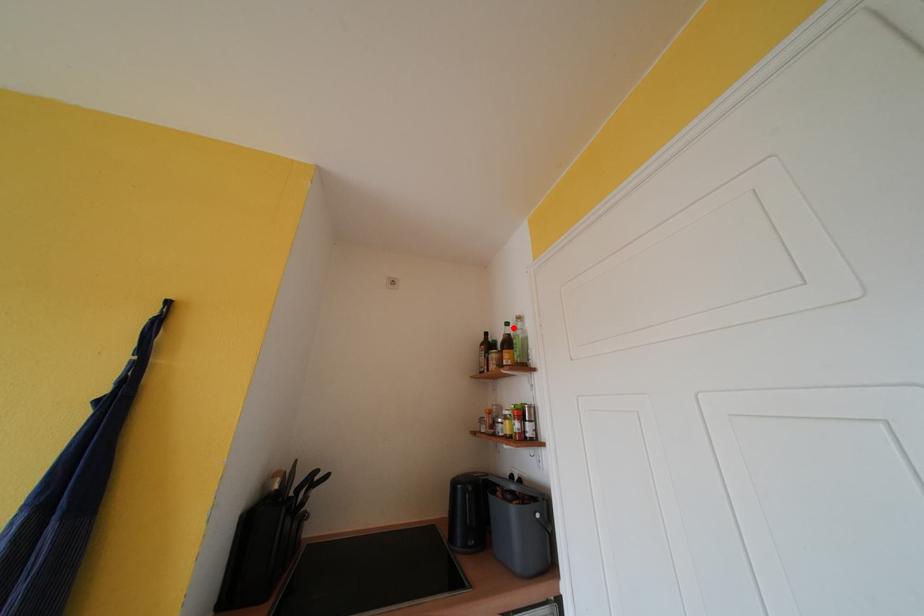
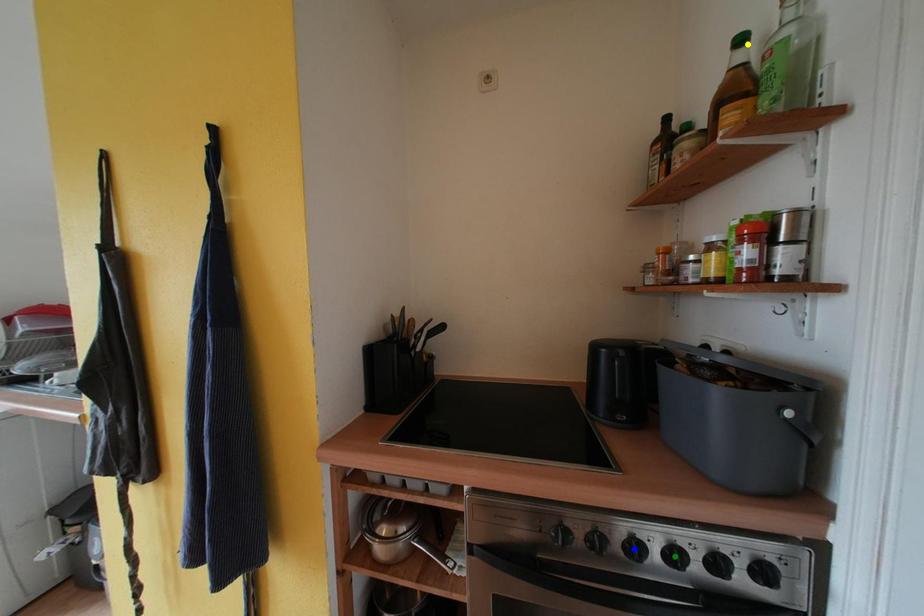
Question: I am providing you with two images of the same scene from different viewpoints. A red point is marked on the first image. You are given multiple points on the second image. In image 2, which mark is for the same physical point as the one in image 1?

Choices:
 (A) blue point
 (B) green point
 (C) yellow point

Answer: (C)